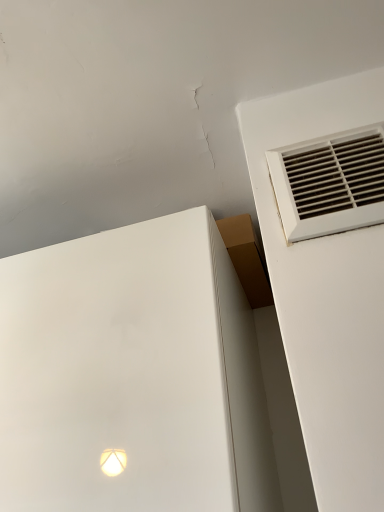
The width and height of the screenshot is (384, 512). What do you see at coordinates (330, 183) in the screenshot?
I see `white plastic air conditioning at upper right` at bounding box center [330, 183].

In order to face white plastic air conditioning at upper right, should I rotate leftwards or rightwards?

Turn right approximately 17.406 degrees to face it.

Find the location of a particular element. Image resolution: width=384 pixels, height=512 pixels. white plastic air conditioning at upper right is located at coordinates (330, 183).

Locate an element on the screen. white plastic air conditioning at upper right is located at coordinates (330, 183).